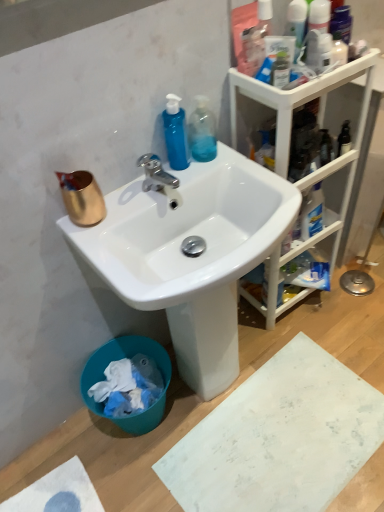
Locate an element on the screen. Image resolution: width=384 pixels, height=512 pixels. vacant space to the right of chrome metallic faucet at upper center is located at coordinates (213, 172).